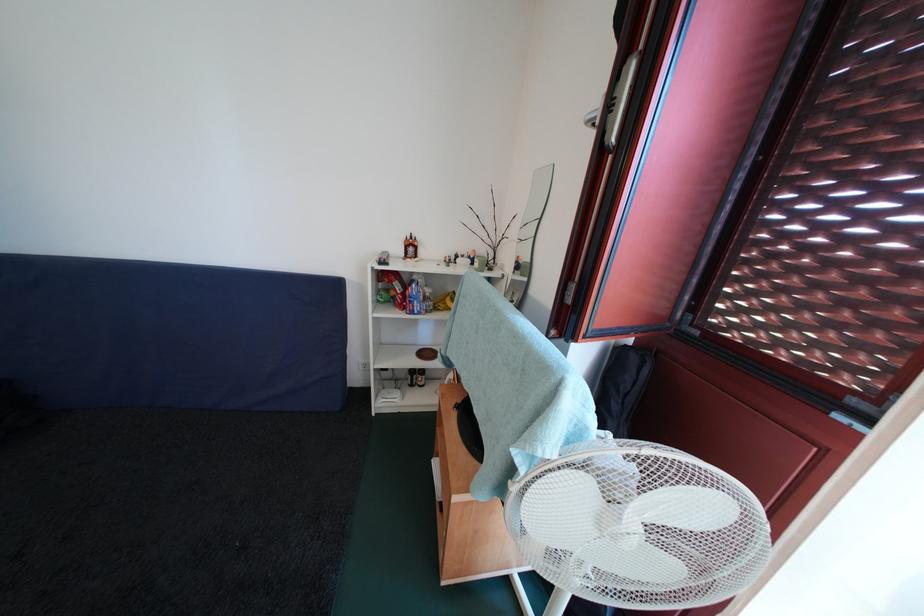
Where would you lift the brown wooden bowl? Please return your answer as a coordinate pair (x, y).

(427, 353)